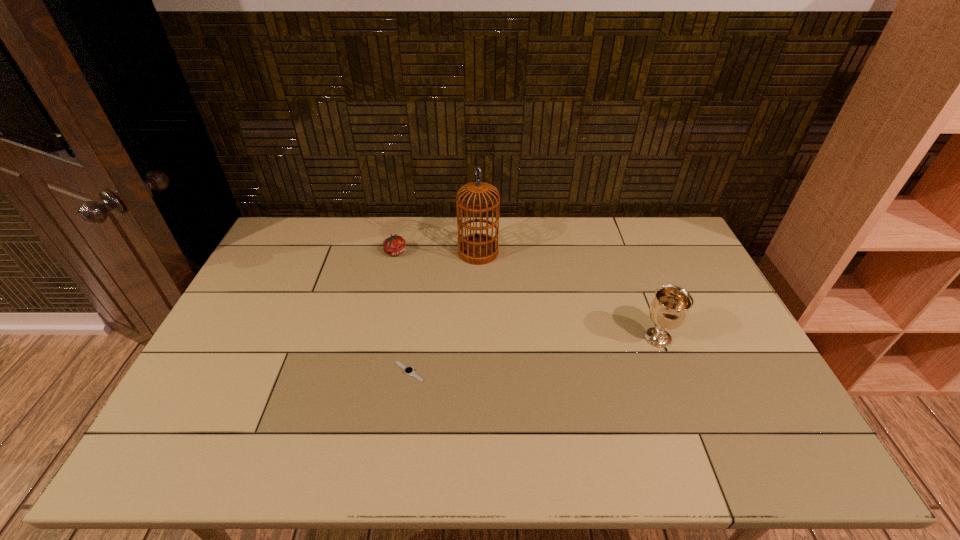
At what (x,y) coordinates should I click in order to perform the action: click on vacant space at the far right corner. Please return your answer as a coordinate pair (x, y). The width and height of the screenshot is (960, 540). Looking at the image, I should click on (683, 232).

I want to click on vacant space at the near right corner of the desktop, so click(731, 437).

This screenshot has width=960, height=540. Identify the location of free space between the shortest object and the third object from left to right. (444, 312).

I want to click on free space that is in between the leftmost object and the nearest object, so click(402, 312).

Find the location of a particular element. This screenshot has height=540, width=960. unoccupied area between the chalice and the watch is located at coordinates (534, 355).

Identify the location of free space between the leftmost object and the rightmost object. (527, 295).

Identify the location of vacant space in between the rightmost object and the birdcage. The height and width of the screenshot is (540, 960). (568, 295).

Find the location of a particular element. Image resolution: width=960 pixels, height=540 pixels. vacant space that's between the tallest object and the third shortest object is located at coordinates (568, 295).

Where is `empty space between the rightmost object and the leftmost object`? This screenshot has width=960, height=540. empty space between the rightmost object and the leftmost object is located at coordinates (527, 295).

Identify the location of vacant point located between the chalice and the tallest object. (568, 295).